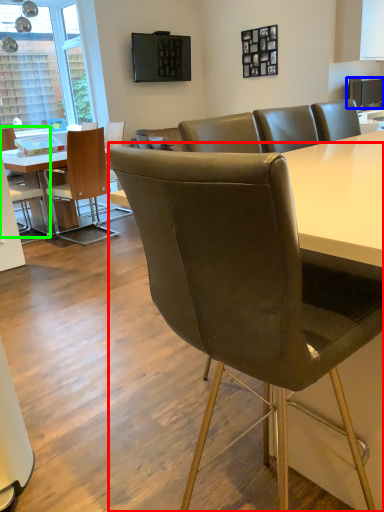
Question: Which object is the closest to the chair (highlighted by a red box)? Choose among these: television (highlighted by a blue box) or chair (highlighted by a green box).

Choices:
 (A) television
 (B) chair

Answer: (B)